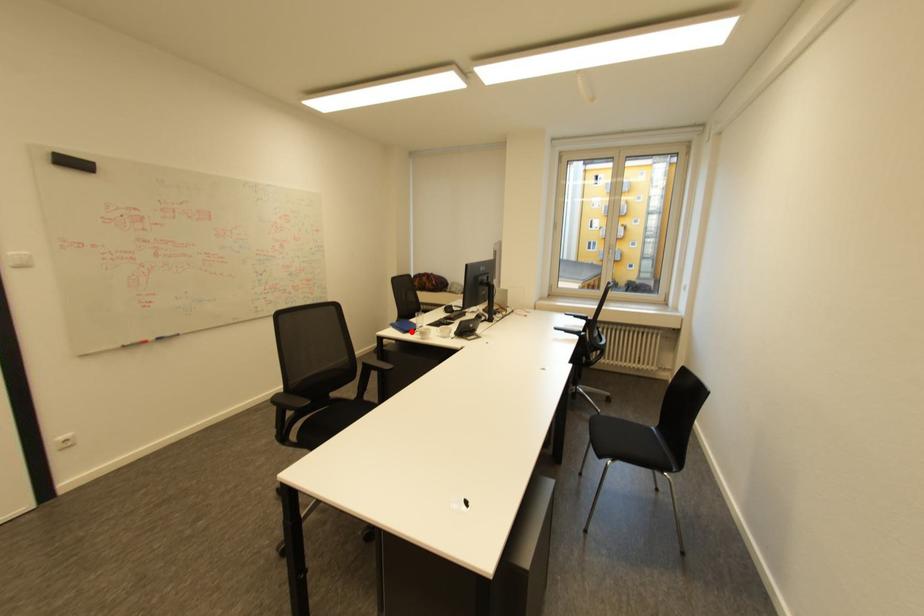
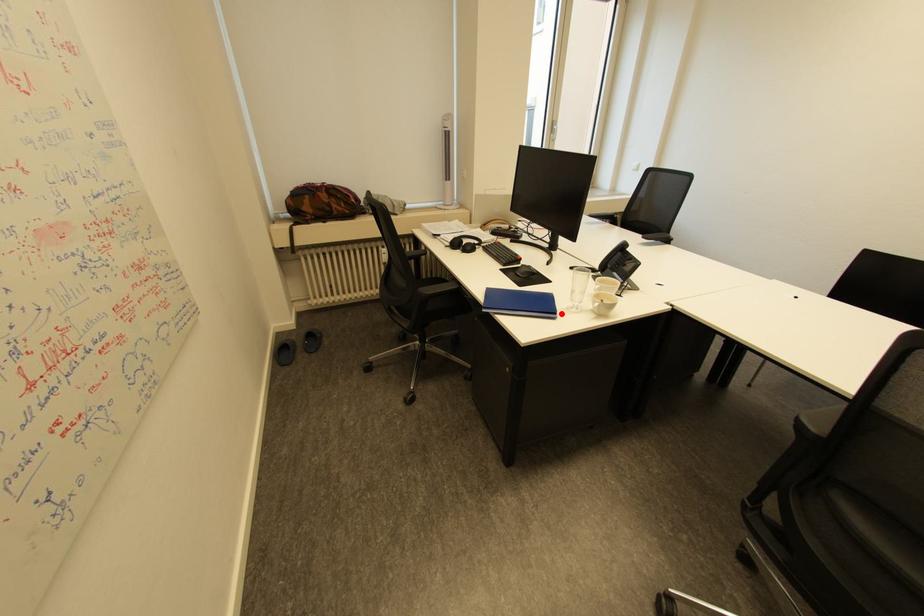
I am providing you with two images of the same scene from different viewpoints. A red point is marked on the first image and another point is marked on the second image. Is the marked point in image1 the same physical position as the marked point in image2?

Yes